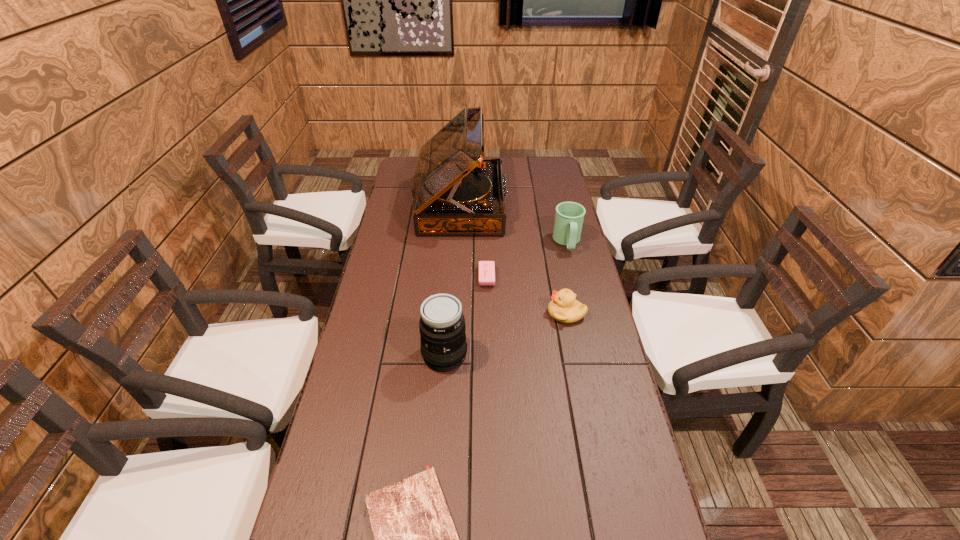
At what (x,y) coordinates should I click in order to perform the action: click on record player. Please return your answer as a coordinate pair (x, y). Looking at the image, I should click on (455, 191).

You are a GUI agent. You are given a task and a screenshot of the screen. Output one action in this format:
    pyautogui.click(x=<x>, y=<y>)
    Task: Click on the second tallest object
    The image size is (960, 540).
    Given the screenshot: What is the action you would take?
    pyautogui.click(x=442, y=326)

Locate an element on the screen. The height and width of the screenshot is (540, 960). telephoto lens is located at coordinates (442, 326).

At what (x,y) coordinates should I click in order to perform the action: click on the third tallest object. Please return your answer as a coordinate pair (x, y). The width and height of the screenshot is (960, 540). Looking at the image, I should click on (569, 217).

Locate an element on the screen. the third shortest object is located at coordinates (564, 307).

Where is `the fourth farthest object`? This screenshot has height=540, width=960. the fourth farthest object is located at coordinates (564, 307).

You are a GUI agent. You are given a task and a screenshot of the screen. Output one action in this format:
    pyautogui.click(x=<x>, y=<y>)
    Task: Click on the fourth nearest object
    Image resolution: width=960 pixels, height=540 pixels.
    Given the screenshot: What is the action you would take?
    [486, 268]

Where is `eraser`? The width and height of the screenshot is (960, 540). eraser is located at coordinates (486, 268).

I want to click on free space located on the front-facing side of the record player, so click(x=524, y=205).

At what (x,y) coordinates should I click in order to perform the action: click on blank space located on the front of the telephoto lens. Please return your answer as a coordinate pair (x, y). Looking at the image, I should click on (438, 444).